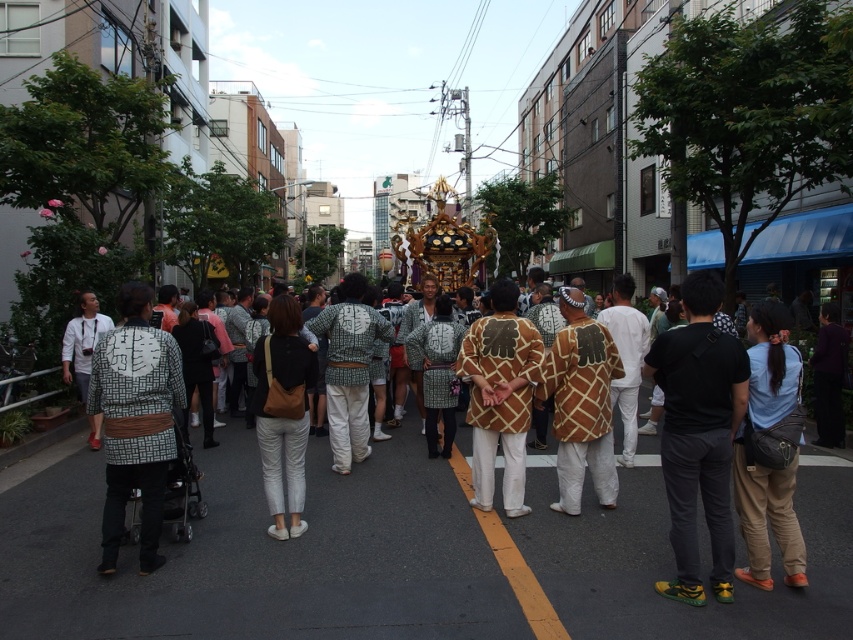
Question: Does brown woven fabric kimono at center have a greater width compared to green woven fabric at center?

Choices:
 (A) no
 (B) yes

Answer: (A)

Question: Which point is farther to the camera?

Choices:
 (A) click(x=834, y=611)
 (B) click(x=437, y=337)
 (C) click(x=494, y=516)

Answer: (B)

Question: Is the position of patterned fabric kimono at left more distant than that of white printed kimono at left?

Choices:
 (A) yes
 (B) no

Answer: (B)

Question: Does black fabric bag at center have a larger size compared to white woven fabric at center?

Choices:
 (A) no
 (B) yes

Answer: (B)

Question: Which point is closer to the camera?

Choices:
 (A) patterned fabric kimono at left
 (B) black fabric bag at center

Answer: (A)

Question: Which object is positioned farthest from the green woven fabric at center?

Choices:
 (A) patterned fabric kimono at left
 (B) black fabric bag at center

Answer: (A)